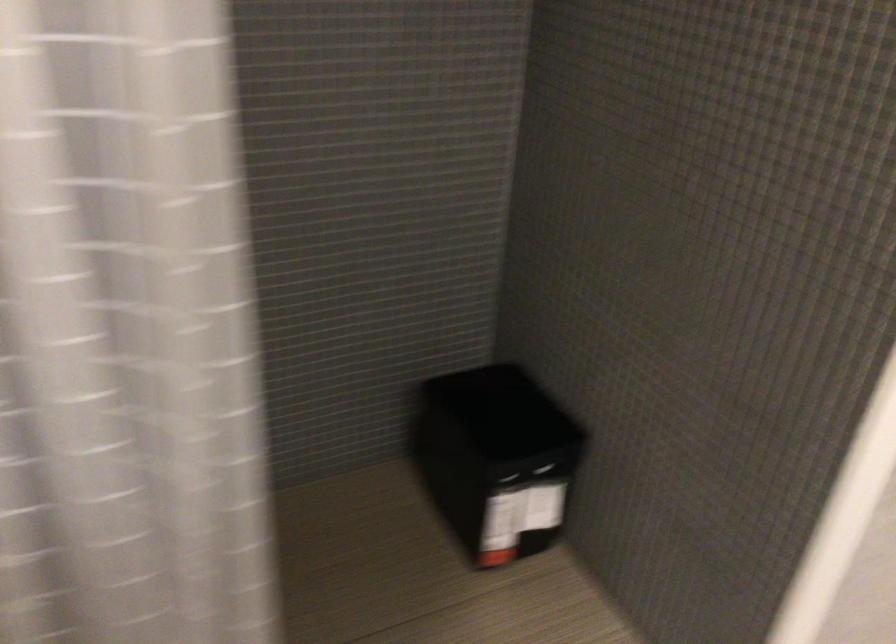
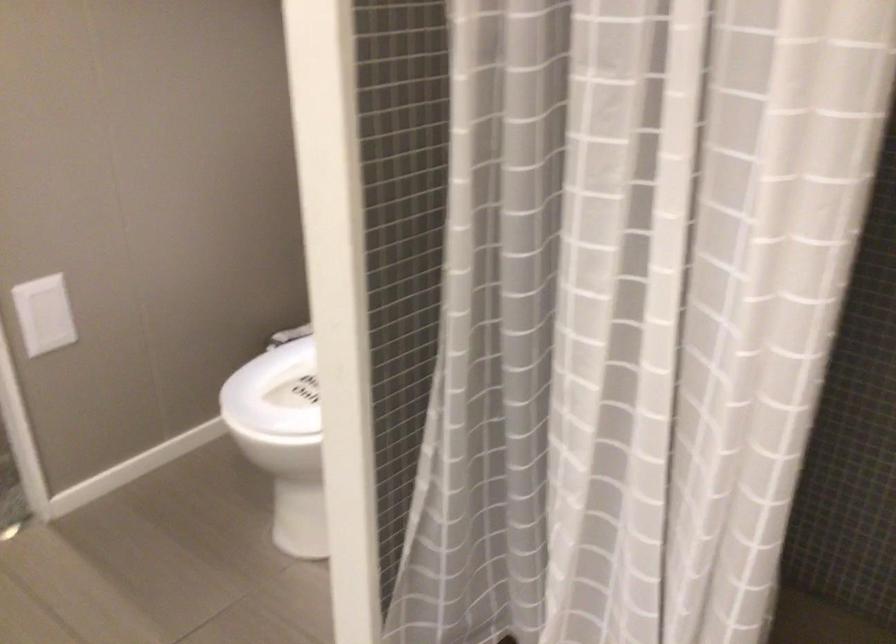
Question: The camera is either moving clockwise (left) or counter-clockwise (right) around the object. The first image is from the beginning of the video and the second image is from the end. Is the camera moving left or right when shooting the video?

Choices:
 (A) Left
 (B) Right

Answer: (B)